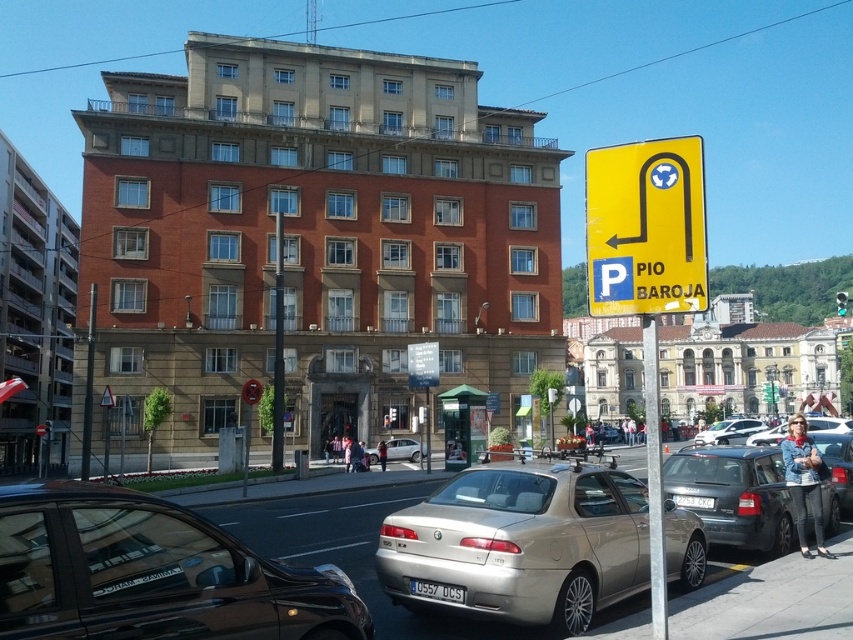
You are a delivery person trying to park a 1.8 meter tall delivery box. You see the shiny black sedan at lower left and the silver metallic sedan at center. Which car should you park the box between to ensure it fits vertically?

The shiny black sedan at lower left has a greater height compared to the silver metallic sedan at center, so you should park the delivery box between the silver metallic sedan at center and the shiny black sedan at lower left, ensuring the box is placed where the height difference allows it to fit vertically.

You are a delivery person trying to park your silver metallic sedan at center. There is a metallic pole at right nearby. Can your car fit in the parking space if the pole is part of the parking space divider?

The metallic pole at right is wider than the silver metallic sedan at center, so the car can fit in the parking space as the pole is part of the divider and does not block the space.

You are a pedestrian trying to cross the street safely. You see a shiny black sedan at lower left and a yellow plastic parking sign at upper right. Which object is closer to the ground?

The shiny black sedan at lower left is closer to the ground because it is positioned below the yellow plastic parking sign at upper right.